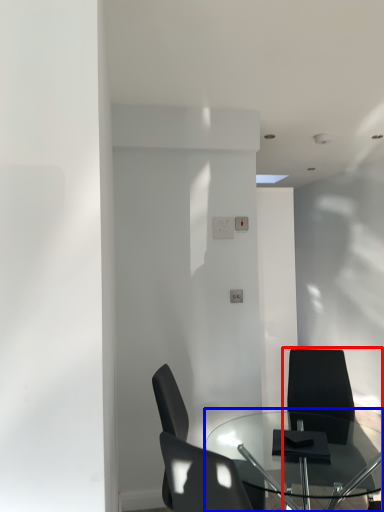
Question: Which point is closer to the camera, chair (highlighted by a red box) or table (highlighted by a blue box)?

Choices:
 (A) chair
 (B) table

Answer: (B)